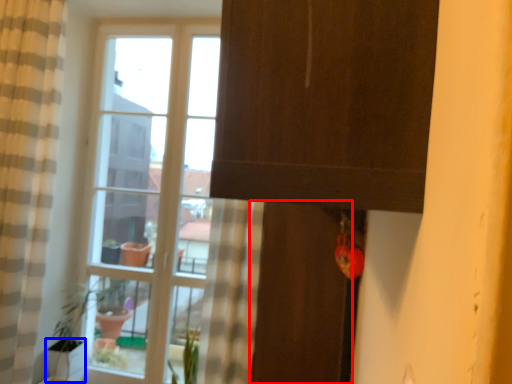
Question: Which of the following is the farthest to the observer, screen door (highlighted by a red box) or glass vase (highlighted by a blue box)?

Choices:
 (A) screen door
 (B) glass vase

Answer: (B)